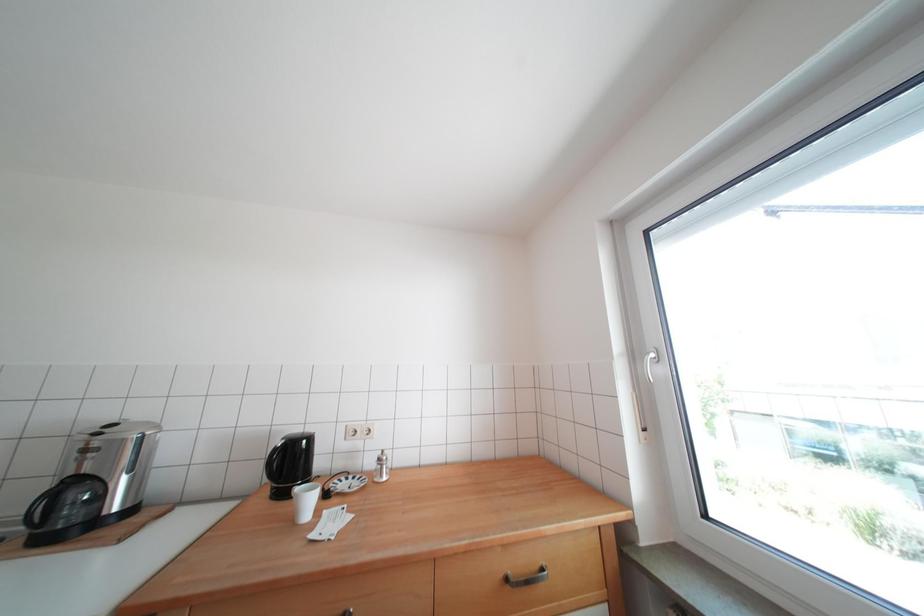
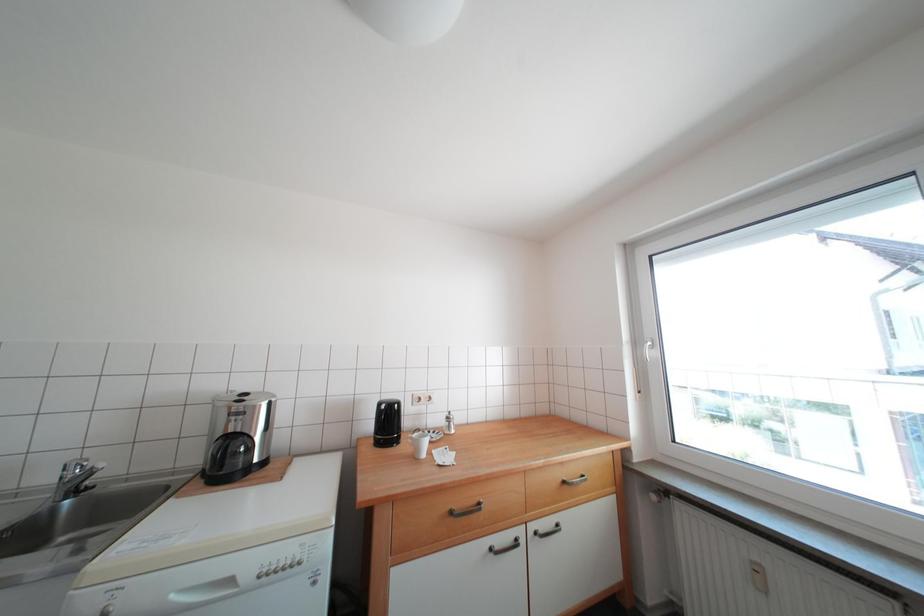
Question: The camera is either moving clockwise (left) or counter-clockwise (right) around the object. The first image is from the beginning of the video and the second image is from the end. Is the camera moving left or right when shooting the video?

Choices:
 (A) Left
 (B) Right

Answer: (A)